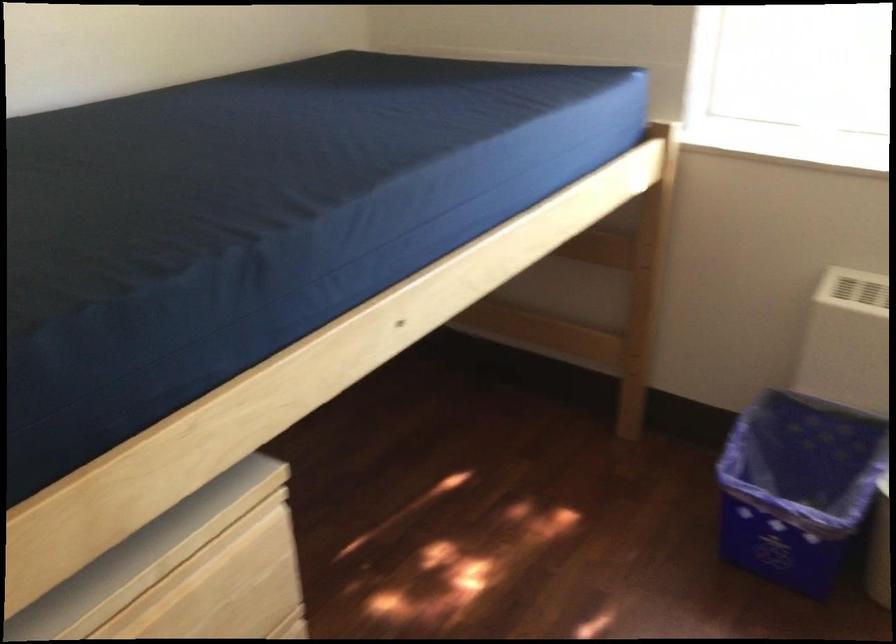
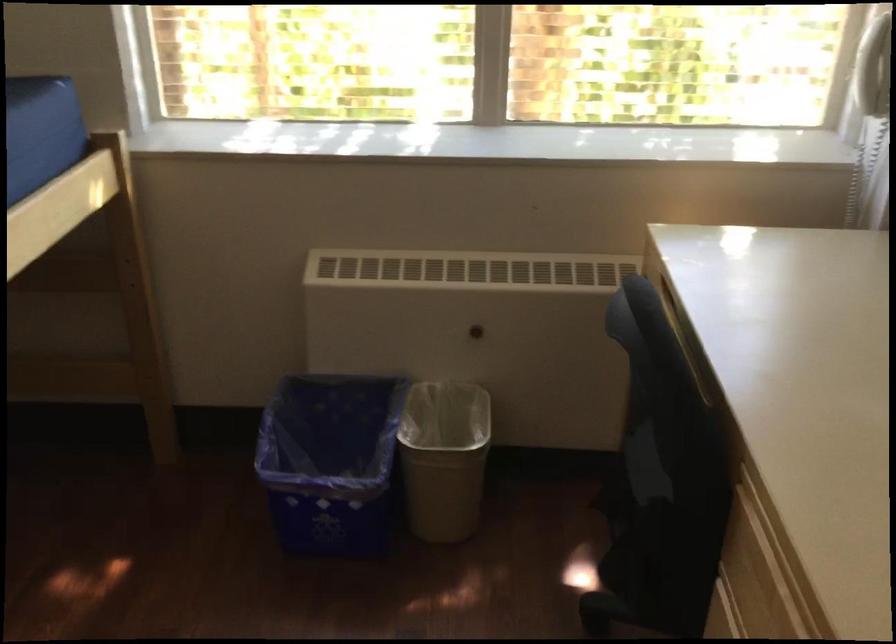
Find the pixel in the second image that matches [789,485] in the first image.

(330, 462)